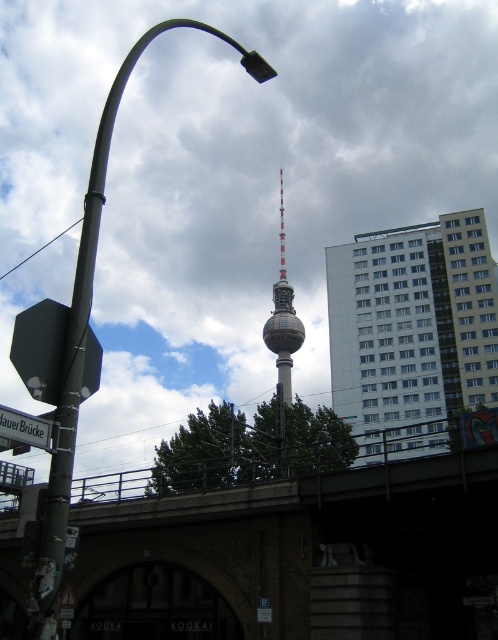
Which of these two, brick bridge at center or metallic streetlight at left, stands taller?

metallic streetlight at left is taller.

Does brick bridge at center appear on the right side of metallic streetlight at left?

Correct, you'll find brick bridge at center to the right of metallic streetlight at left.

Is point (145, 602) less distant than point (67, 380)?

No, it is behind (67, 380).

The image size is (498, 640). I want to click on brick bridge at center, so click(298, 557).

Looking at this image, does white glass building at upper right lie in front of metallic streetlight at left?

No.

What do you see at coordinates (411, 332) in the screenshot? I see `white glass building at upper right` at bounding box center [411, 332].

Find the location of a particular element. Image resolution: width=498 pixels, height=640 pixels. white glass building at upper right is located at coordinates (411, 332).

Is silver metallic tower at center to the left of white plastic street sign at lower left from the viewer's perspective?

In fact, silver metallic tower at center is to the right of white plastic street sign at lower left.

Which is in front, point (274, 317) or point (35, 420)?

Point (35, 420)

At what (x,y) coordinates should I click in order to perform the action: click on silver metallic tower at center. Please return your answer as a coordinate pair (x, y). The height and width of the screenshot is (640, 498). Looking at the image, I should click on (282, 320).